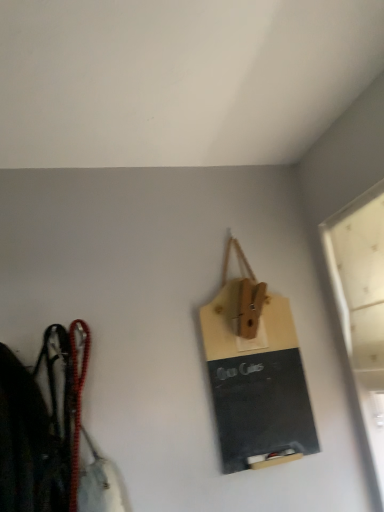
Question: Considering the positions of matte black chalkboard at center and white frosted glass window at upper right in the image, is matte black chalkboard at center wider or thinner than white frosted glass window at upper right?

Choices:
 (A) thin
 (B) wide

Answer: (A)

Question: Visually, is matte black chalkboard at center positioned to the left or to the right of white frosted glass window at upper right?

Choices:
 (A) left
 (B) right

Answer: (A)

Question: From the image's perspective, is matte black chalkboard at center located above or below white frosted glass window at upper right?

Choices:
 (A) below
 (B) above

Answer: (A)

Question: In terms of width, does white frosted glass window at upper right look wider or thinner when compared to matte black chalkboard at center?

Choices:
 (A) wide
 (B) thin

Answer: (A)

Question: Visually, is white frosted glass window at upper right positioned to the left or to the right of matte black chalkboard at center?

Choices:
 (A) left
 (B) right

Answer: (B)

Question: Is point (379, 423) closer or farther from the camera than point (291, 353)?

Choices:
 (A) farther
 (B) closer

Answer: (B)

Question: From the image's perspective, relative to matte black chalkboard at center, is white frosted glass window at upper right above or below?

Choices:
 (A) below
 (B) above

Answer: (B)